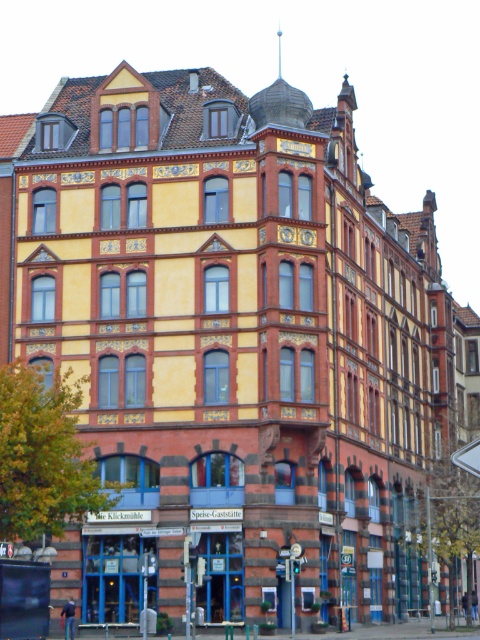
Does white plastic street sign at lower right have a greater width compared to metallic pole at center?

Yes.

Is white plastic street sign at lower right taller than metallic pole at center?

Indeed, white plastic street sign at lower right has a greater height compared to metallic pole at center.

Is point (470, 458) behind point (291, 604)?

No.

The image size is (480, 640). What are the coordinates of `white plastic street sign at lower right` in the screenshot? It's located at (468, 458).